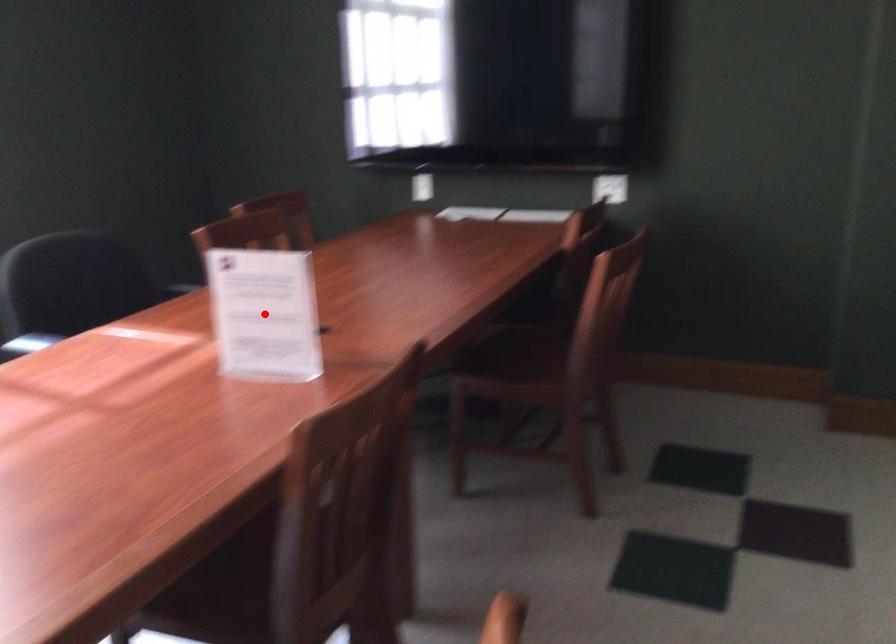
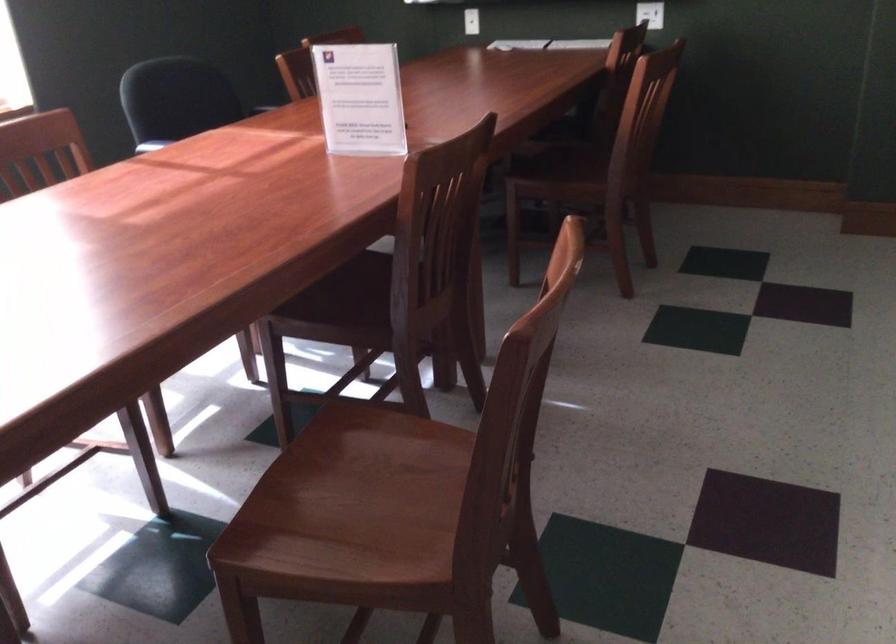
Question: A red point is marked in image1. In image2, is the corresponding 3D point closer to the camera or farther? Reply with the corresponding letter.

Choices:
 (A) The corresponding 3D point is closer.
 (B) The corresponding 3D point is farther.

Answer: (B)